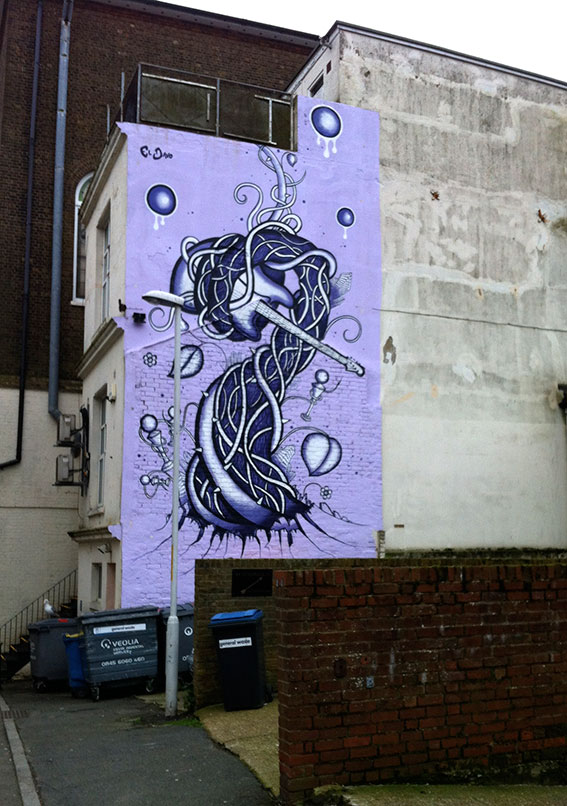
Image resolution: width=567 pixels, height=806 pixels. I want to click on brick wall, so click(x=387, y=691), click(x=217, y=600), click(x=50, y=526), click(x=33, y=472), click(x=117, y=443), click(x=331, y=389), click(x=469, y=426), click(x=471, y=214), click(x=201, y=60).